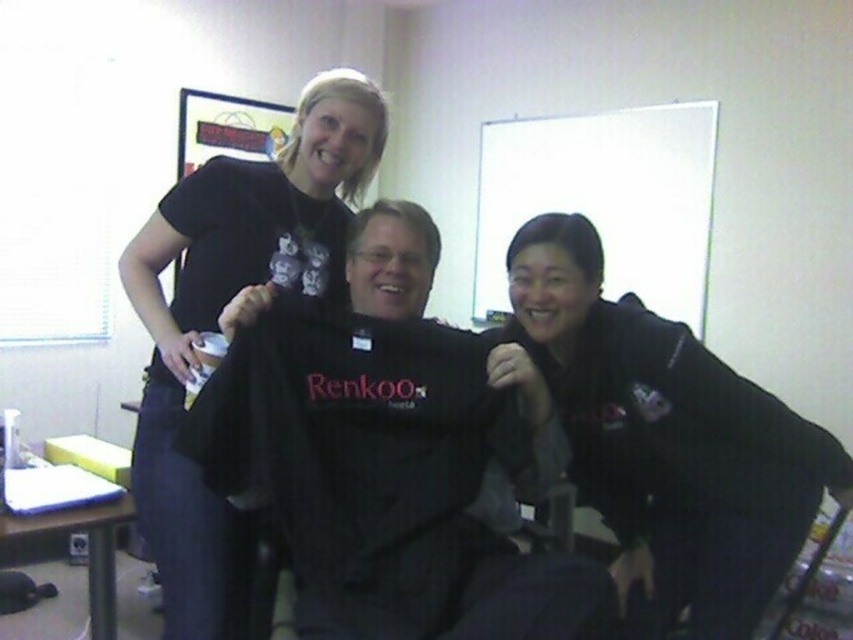
Question: From the image, what is the correct spatial relationship of black fabric shirt at center in relation to black fleece jacket at lower right?

Choices:
 (A) left
 (B) right

Answer: (A)

Question: Can you confirm if black fabric shirt at center is smaller than black fleece jacket at lower right?

Choices:
 (A) yes
 (B) no

Answer: (A)

Question: Which point is closer to the camera?

Choices:
 (A) black fabric shirt at center
 (B) black fleece jacket at lower right

Answer: (A)

Question: Is black fabric shirt at center positioned behind black fleece jacket at lower right?

Choices:
 (A) no
 (B) yes

Answer: (A)

Question: Which point appears farthest from the camera in this image?

Choices:
 (A) (566, 577)
 (B) (593, 388)

Answer: (B)